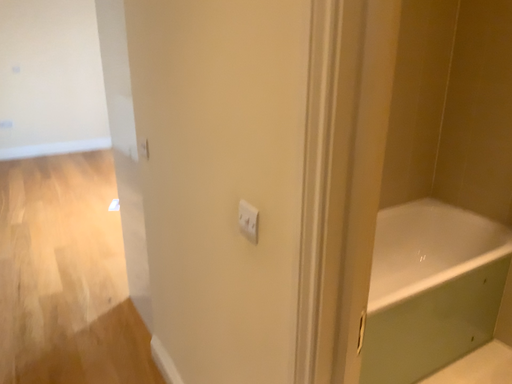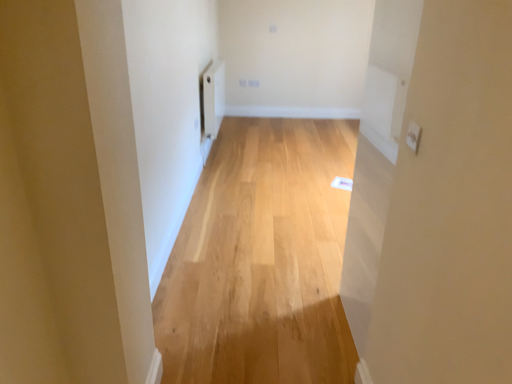
Question: How did the camera likely rotate when shooting the video?

Choices:
 (A) rotated right
 (B) rotated left

Answer: (B)